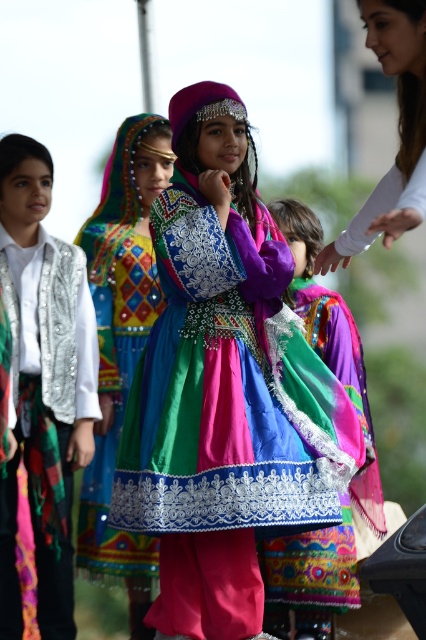
Question: Which point is farther from the camera taking this photo?

Choices:
 (A) (196, 563)
 (B) (394, 51)
 (C) (94, 282)

Answer: (C)

Question: Does multicolored embroidered dress at center appear over white matte shirt at upper right?

Choices:
 (A) yes
 (B) no

Answer: (B)

Question: From the image, what is the correct spatial relationship of multicolored embroidered dress at center in relation to white matte shirt at upper right?

Choices:
 (A) above
 (B) below

Answer: (B)

Question: Among these points, which one is farthest from the camera?

Choices:
 (A) (106, 556)
 (B) (420, 195)
 (C) (276, 554)

Answer: (A)

Question: Does embroidered silk dress at center appear on the left side of white matte shirt at upper right?

Choices:
 (A) yes
 (B) no

Answer: (A)

Question: Among these objects, which one is nearest to the camera?

Choices:
 (A) silver sequined vest at left
 (B) multicolored embroidered dress at center

Answer: (A)